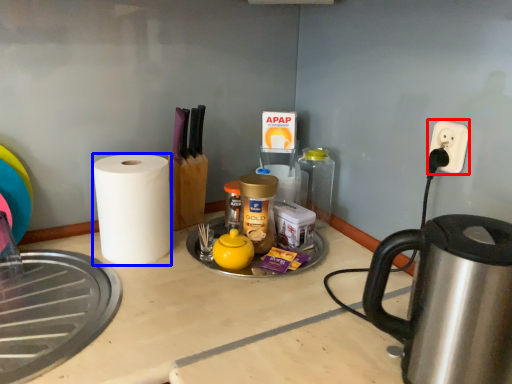
Question: Which of the following is the farthest to the observer, electric outlet (highlighted by a red box) or paper towel (highlighted by a blue box)?

Choices:
 (A) electric outlet
 (B) paper towel

Answer: (B)